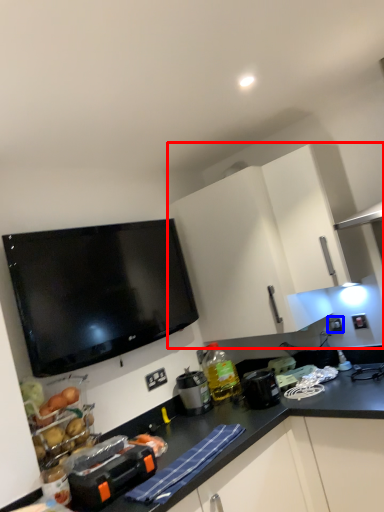
Question: Which object appears farthest to the camera in this image, cabinetry (highlighted by a red box) or electric outlet (highlighted by a blue box)?

Choices:
 (A) cabinetry
 (B) electric outlet

Answer: (B)